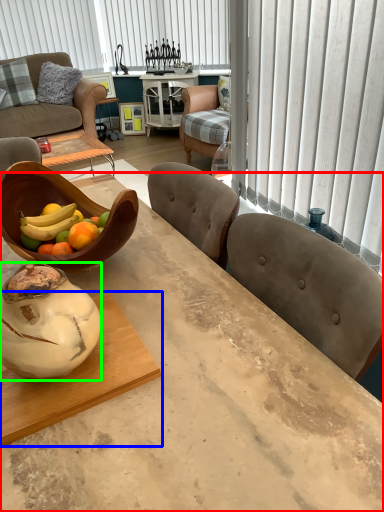
Question: Which is nearer to the desk (highlighted by a red box)? coffee table (highlighted by a blue box) or vase (highlighted by a green box).

Choices:
 (A) coffee table
 (B) vase

Answer: (A)